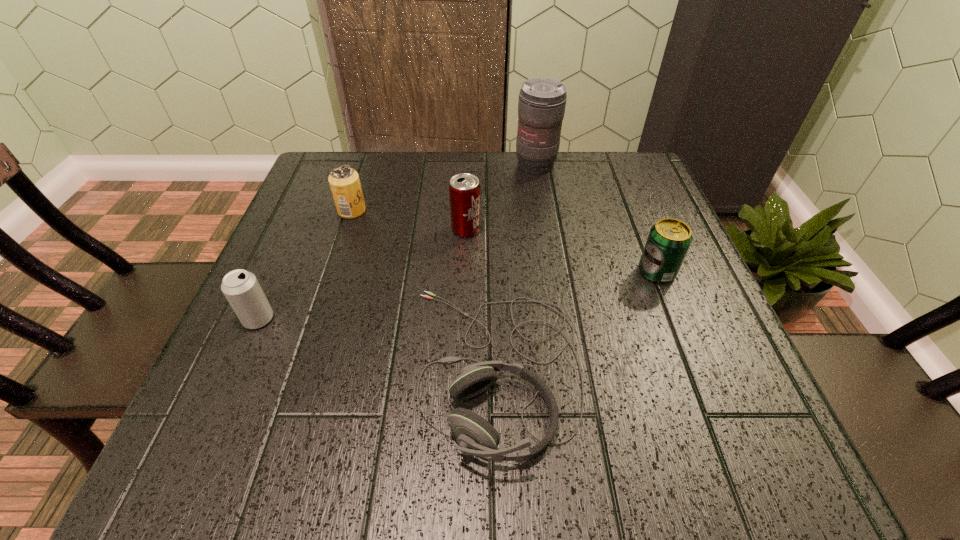
Where is `the second closest object relative to the fifth object from right to left`? This screenshot has height=540, width=960. the second closest object relative to the fifth object from right to left is located at coordinates coord(241,288).

Choose which object is the fifth nearest neighbor to the rightmost object. Please provide its 2D coordinates. Your answer should be formatted as a tuple, i.e. [(x, y)], where the tuple contains the x and y coordinates of a point satisfying the conditions above.

[(241, 288)]

Where is `beer can object that ranks as the third closest to the rightmost beer can`? This screenshot has height=540, width=960. beer can object that ranks as the third closest to the rightmost beer can is located at coordinates (241, 288).

Locate an element on the screen. This screenshot has height=540, width=960. beer can identified as the second closest to the third nearest beer can is located at coordinates (668, 242).

Where is `vacant area in the image that satisfies the following two spatial constraints: 1. on the side of the tallest object where the control switches are located; 2. on the outer surface of the shortest object`? The image size is (960, 540). vacant area in the image that satisfies the following two spatial constraints: 1. on the side of the tallest object where the control switches are located; 2. on the outer surface of the shortest object is located at coordinates (569, 369).

The image size is (960, 540). In order to click on free space in the image that satisfies the following two spatial constraints: 1. on the back side of the fifth object from right to left; 2. on the right side of the leftmost beer can in this screenshot , I will do `click(306, 211)`.

The width and height of the screenshot is (960, 540). I want to click on free point that satisfies the following two spatial constraints: 1. on the side of the tallest object where the control switches are located; 2. on the outer surface of the headset, so click(569, 369).